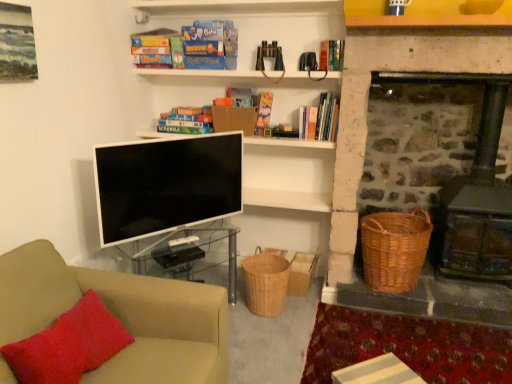
Locate an element on the screen. This screenshot has width=512, height=384. free location in front of woven brown basket at lower center, the third basket from the right is located at coordinates (265, 328).